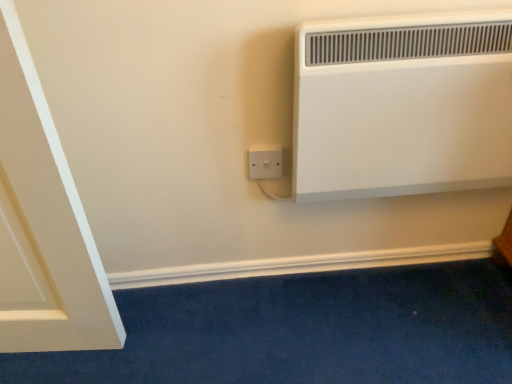
Question: From a real-world perspective, is white matte heater at upper right above or below white plastic socket at lower center?

Choices:
 (A) below
 (B) above

Answer: (B)

Question: In terms of height, does white matte heater at upper right look taller or shorter compared to white plastic socket at lower center?

Choices:
 (A) short
 (B) tall

Answer: (B)

Question: Looking at their shapes, would you say white matte heater at upper right is wider or thinner than white plastic socket at lower center?

Choices:
 (A) thin
 (B) wide

Answer: (B)

Question: Considering their positions, is white plastic socket at lower center located in front of or behind white matte heater at upper right?

Choices:
 (A) front
 (B) behind

Answer: (B)

Question: Is white plastic socket at lower center inside the boundaries of white matte heater at upper right, or outside?

Choices:
 (A) outside
 (B) inside

Answer: (A)

Question: Is point (x=274, y=162) positioned closer to the camera than point (x=460, y=97)?

Choices:
 (A) farther
 (B) closer

Answer: (A)

Question: In the image, is white plastic socket at lower center on the left side or the right side of white matte heater at upper right?

Choices:
 (A) left
 (B) right

Answer: (A)